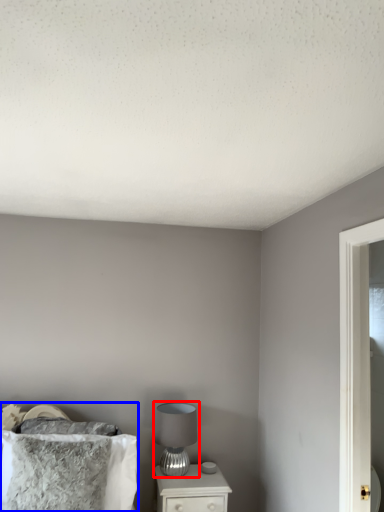
Question: Which object is further to the camera taking this photo, table lamp (highlighted by a red box) or bed (highlighted by a blue box)?

Choices:
 (A) table lamp
 (B) bed

Answer: (A)